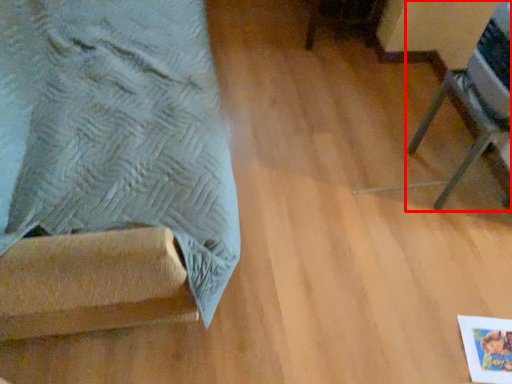
Question: From the image's perspective, where is furniture (annotated by the red box) located in relation to furniture in the image?

Choices:
 (A) above
 (B) below

Answer: (B)